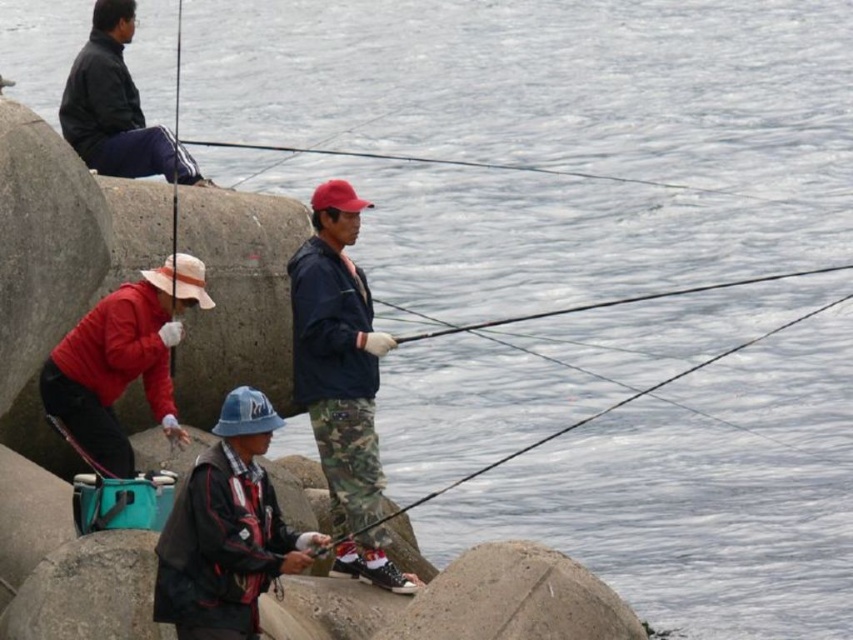
You are a fisherman standing at the center of the jetty. You notice your camouflage pants at center and your camouflage fishing pole at center. Which item is closer to you?

The camouflage pants at center is 33.38 feet away from the camouflage fishing pole at center, so the camouflage pants at center is closer to you since it is only 33.38 feet away from the pole.

You are a photographer trying to capture a clear shot of the camouflage pants at center and the camouflage fishing pole at center. Which object is closer to your camera lens?

The camouflage pants at center is closer to the camera lens because it is further to the viewer than the camouflage fishing pole at center.

You are a photographer trying to capture a shot of the matte black jacket at upper left and the camouflage fishing pole at center. Since you want both subjects in the frame, can you confirm if they are positioned side by side horizontally?

The matte black jacket at upper left is to the left of the camouflage fishing pole at center, so they are positioned side by side horizontally.